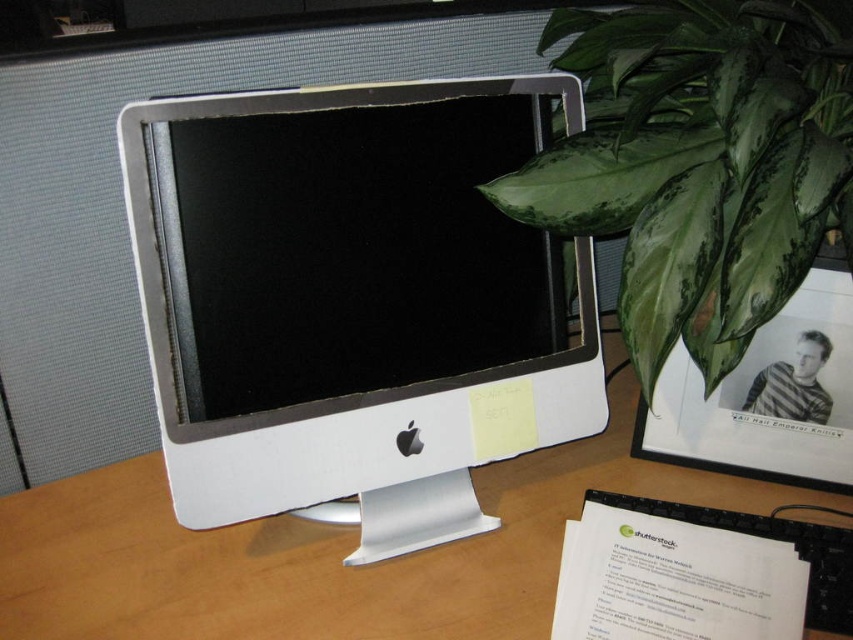
How far apart are white plastic desktop computer at center and white plastic computer monitor at center?

white plastic desktop computer at center and white plastic computer monitor at center are 11.09 inches apart from each other.

From the picture: Between white plastic desktop computer at center and white plastic computer monitor at center, which one has more height?

With more height is white plastic desktop computer at center.

Find the location of `white plastic desktop computer at center`. white plastic desktop computer at center is located at coordinates (352, 301).

Does white plastic desktop computer at center have a lesser width compared to green glossy leaf at upper right?

Result: No.

Is white plastic desktop computer at center taller than green glossy leaf at upper right?

Yes, white plastic desktop computer at center is taller than green glossy leaf at upper right.

Which is behind, point (357, 480) or point (757, 241)?

The point (357, 480) is behind.

Identify the location of white plastic desktop computer at center. (352, 301).

Can you confirm if green glossy leaf at upper right is thinner than white plastic computer monitor at center?

In fact, green glossy leaf at upper right might be wider than white plastic computer monitor at center.

Is green glossy leaf at upper right positioned behind white plastic computer monitor at center?

No, green glossy leaf at upper right is in front of white plastic computer monitor at center.

Identify the location of green glossy leaf at upper right. Image resolution: width=853 pixels, height=640 pixels. (699, 164).